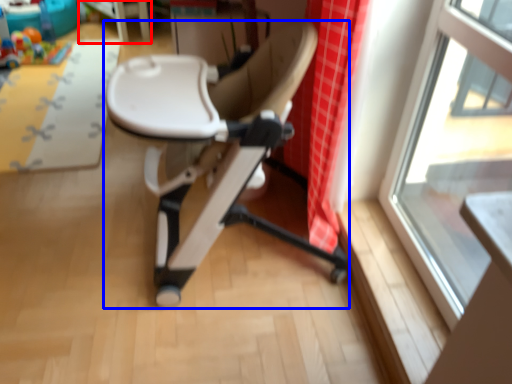
Question: Which of the following is the farthest to the observer, table (highlighted by a red box) or chair (highlighted by a blue box)?

Choices:
 (A) table
 (B) chair

Answer: (A)